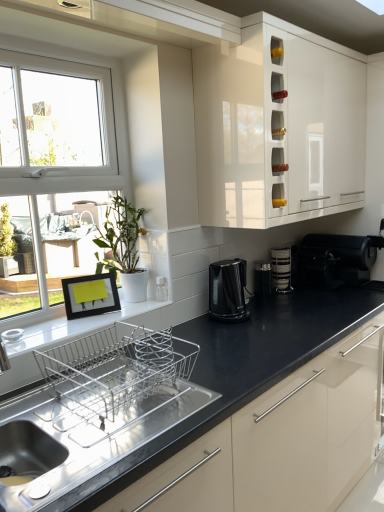
Locate an element on the screen. The width and height of the screenshot is (384, 512). free space to the left of matte white coffee maker at upper center, which appears as the 3th appliance when viewed from the back is located at coordinates pos(135,306).